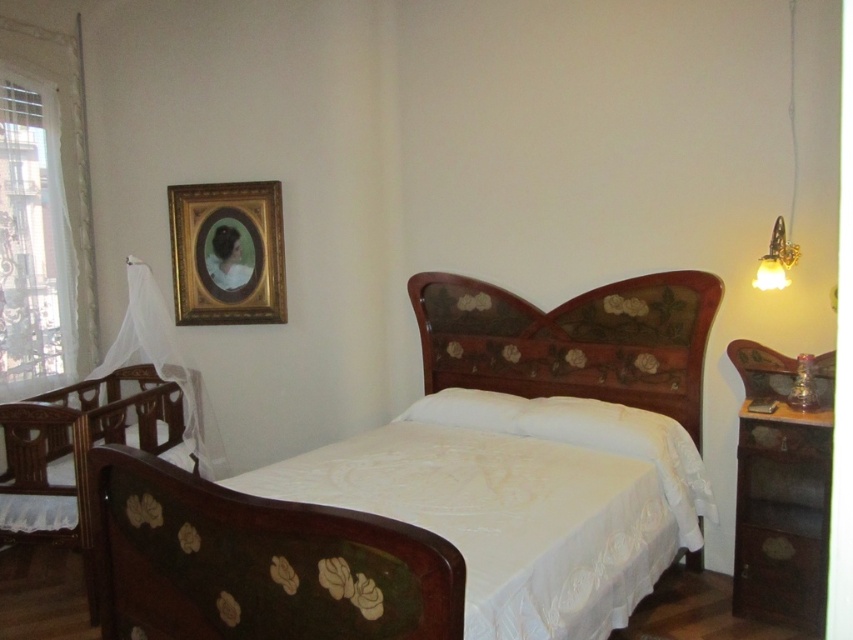
Can you confirm if gold/gilded picture frame at upper left is positioned above white soft pillow at center?

Correct, gold/gilded picture frame at upper left is located above white soft pillow at center.

From the picture: Who is shorter, gold/gilded picture frame at upper left or white soft pillow at center?

Standing shorter between the two is white soft pillow at center.

I want to click on gold/gilded picture frame at upper left, so click(x=227, y=252).

Who is higher up, wooden bed at center or white sheer curtain at left?

white sheer curtain at left is higher up.

I want to click on wooden bed at center, so click(544, 451).

Can you confirm if wooden bed at center is smaller than wooden crib at left?

No.

Which is in front, point (604, 460) or point (39, 508)?

Point (604, 460)

Find the location of a particular element. The width and height of the screenshot is (853, 640). wooden bed at center is located at coordinates (544, 451).